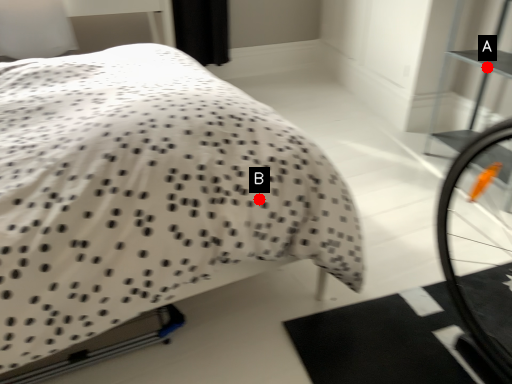
Question: Two points are circled on the image, labeled by A and B beside each circle. Which point is farther from the camera taking this photo?

Choices:
 (A) A is further
 (B) B is further

Answer: (A)